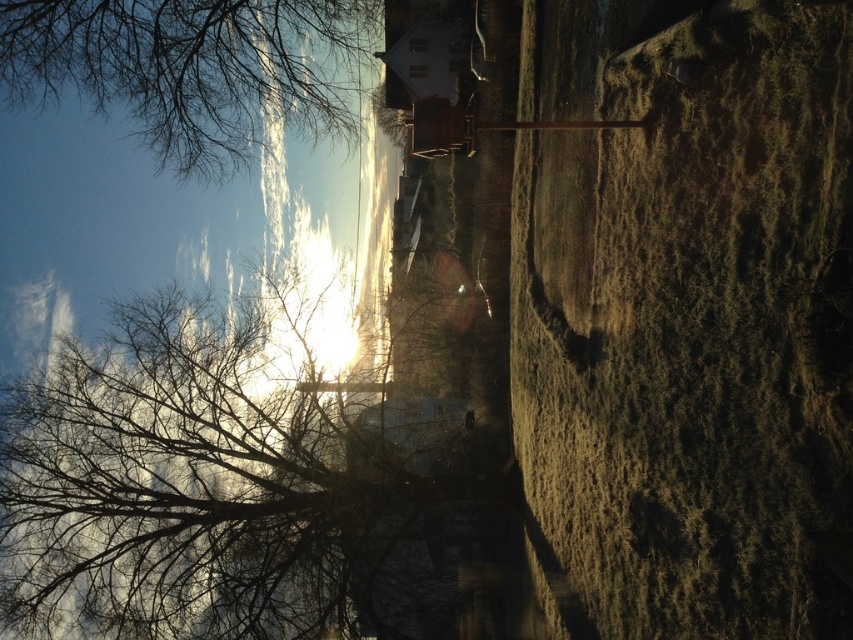
You are standing at the center of the grassy area and want to take a photo of the sun without any obstruction. Considering the position of the bare branches at left, which direction should you face to avoid them?

The bare branches at left are located at point (224, 488), so facing away from the left side would avoid them. Facing towards the right or directly towards the sun might be better.

You are an artist sketching the scene and want to draw the bare branches at left and the bare branches at upper left accurately. Which of the two is taller?

The bare branches at left is much taller than the bare branches at upper left.